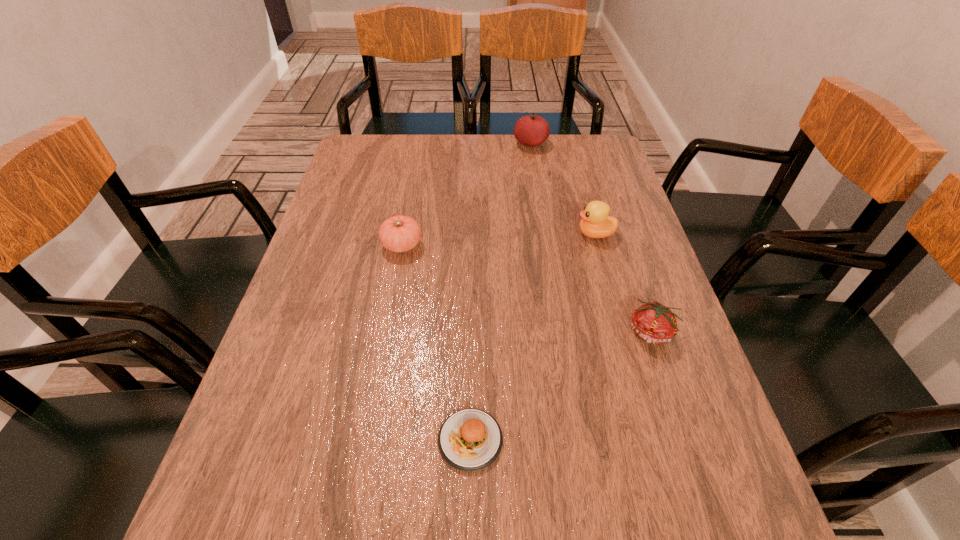
The image size is (960, 540). Find the location of `vacant area that satisfies the following two spatial constraints: 1. on the face of the duckling; 2. on the front side of the leftmost object`. vacant area that satisfies the following two spatial constraints: 1. on the face of the duckling; 2. on the front side of the leftmost object is located at coordinates (598, 245).

Locate an element on the screen. The width and height of the screenshot is (960, 540). free space that satisfies the following two spatial constraints: 1. on the face of the duckling; 2. on the front side of the nearest object is located at coordinates (653, 440).

I want to click on vacant area in the image that satisfies the following two spatial constraints: 1. on the front side of the second nearest object; 2. on the left side of the second tomato from left to right, so point(561,333).

Where is `vacant region that satisfies the following two spatial constraints: 1. on the face of the duckling; 2. on the front side of the food`? Image resolution: width=960 pixels, height=540 pixels. vacant region that satisfies the following two spatial constraints: 1. on the face of the duckling; 2. on the front side of the food is located at coordinates (653, 440).

Find the location of `vacant space that satisfies the following two spatial constraints: 1. on the back side of the rightmost tomato; 2. on the face of the duckling`. vacant space that satisfies the following two spatial constraints: 1. on the back side of the rightmost tomato; 2. on the face of the duckling is located at coordinates (619, 234).